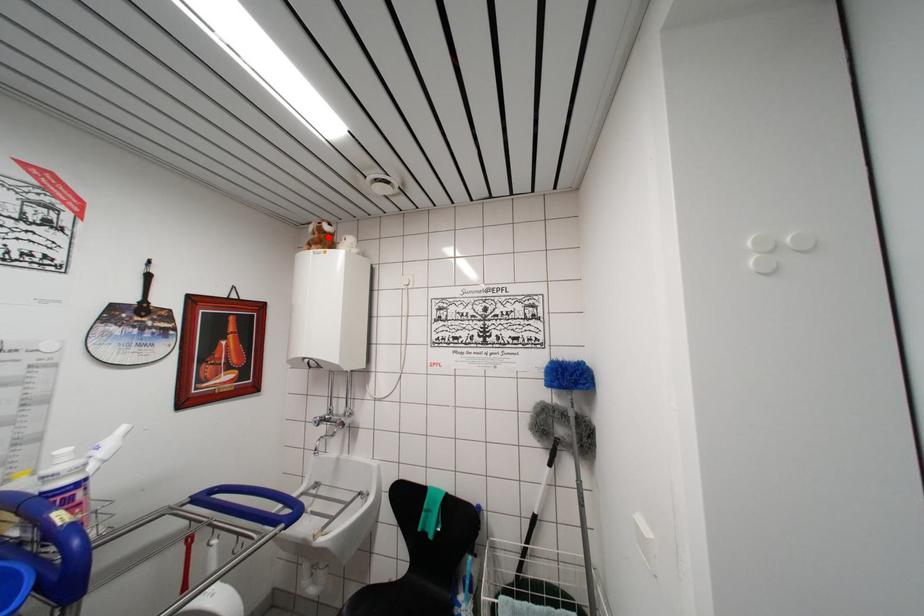
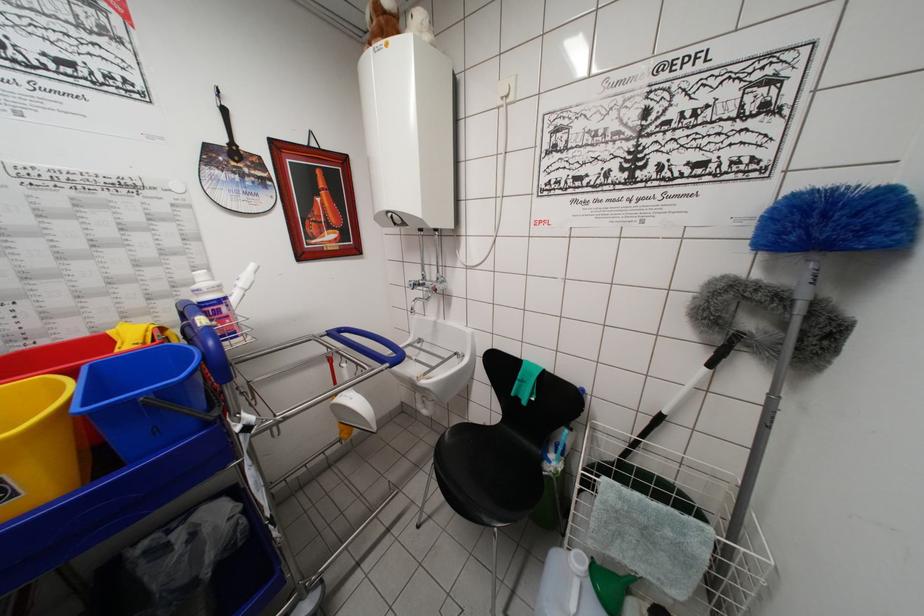
In the second image, find the point that corresponds to the highlighted location in the first image.

(387, 17)